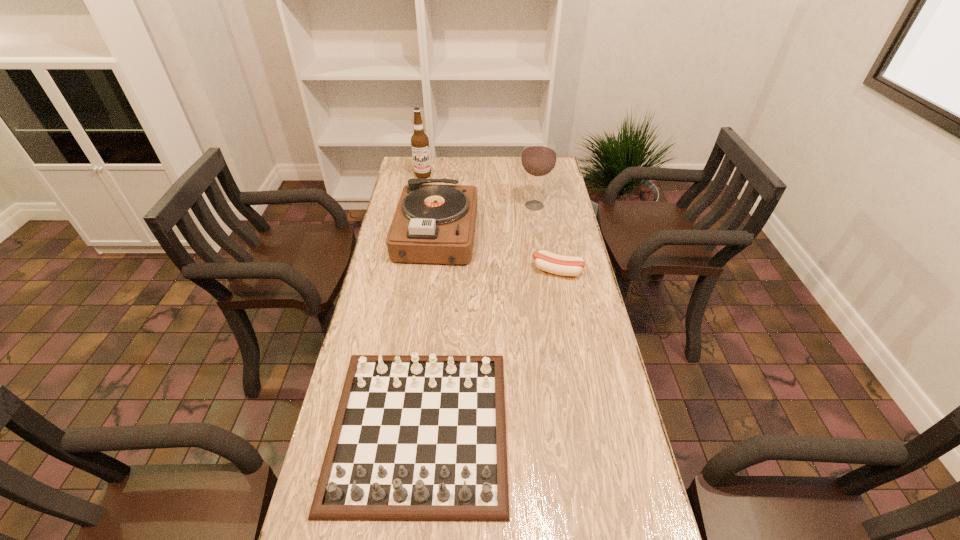
Where is `the farther alcohol`? the farther alcohol is located at coordinates (419, 141).

Locate an element on the screen. The width and height of the screenshot is (960, 540). the left alcohol is located at coordinates (419, 141).

This screenshot has height=540, width=960. What are the coordinates of `the nearer alcohol` in the screenshot? It's located at (538, 159).

Find the location of `the third tallest object`. the third tallest object is located at coordinates (432, 223).

Where is `the fourth tallest object`? Image resolution: width=960 pixels, height=540 pixels. the fourth tallest object is located at coordinates [416, 437].

You are a GUI agent. You are given a task and a screenshot of the screen. Output one action in this format:
    pyautogui.click(x=<x>, y=<y>)
    Task: Click on the nearest object
    
    Given the screenshot: What is the action you would take?
    pyautogui.click(x=416, y=437)

Find the location of a particular element. The image size is (960, 540). the shortest object is located at coordinates (556, 264).

At what (x,y) coordinates should I click in order to perform the action: click on free space located on the label of the farthest object. Please return your answer as a coordinate pair (x, y). Looking at the image, I should click on point(420,190).

The image size is (960, 540). What are the coordinates of `blank space located 0.360m on the left of the nearer alcohol` in the screenshot? It's located at (x=430, y=205).

This screenshot has height=540, width=960. In order to click on vacant space located on the back of the third shortest object in this screenshot , I will do `click(444, 164)`.